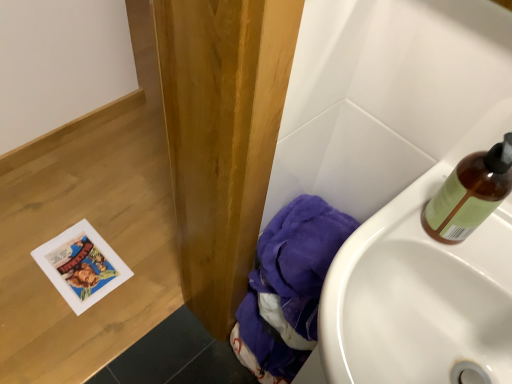
Locate an element on the screen. This screenshot has width=512, height=384. blank space to the left of translucent amber bottle at upper right is located at coordinates (384, 233).